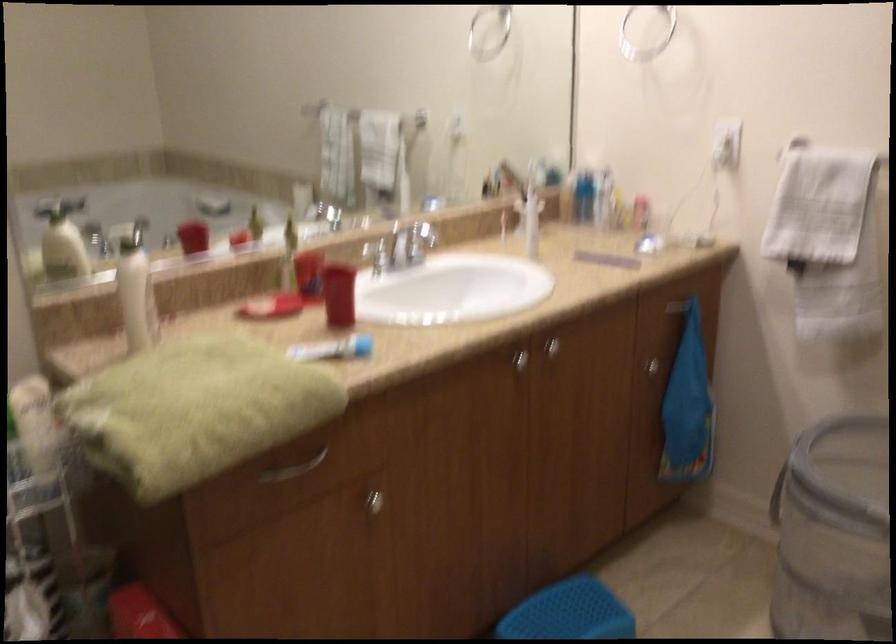
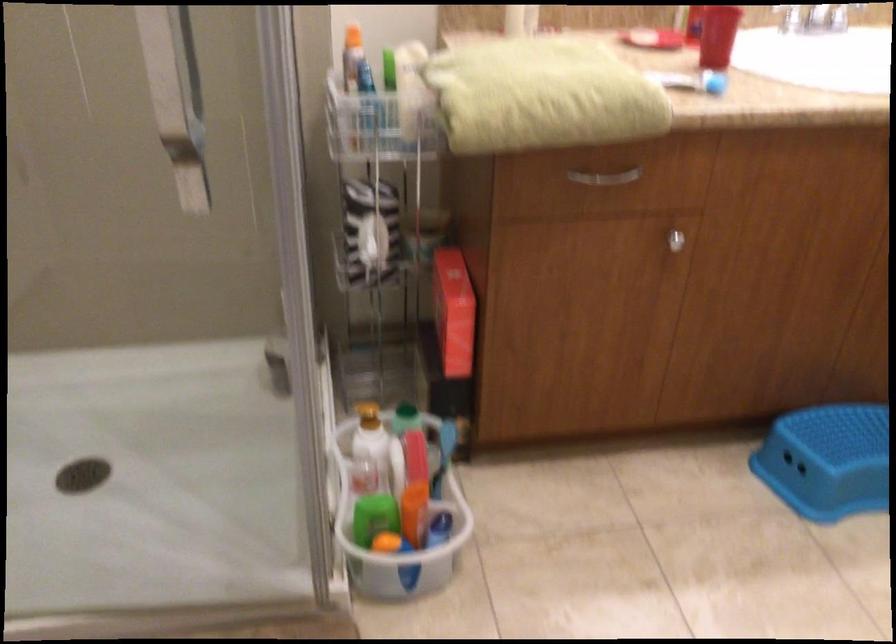
First-person continuous shooting, in which direction is the camera rotating?

The camera's rotation is toward left-down.